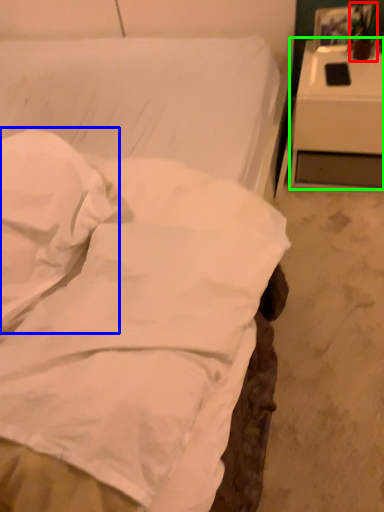
Question: Which object is positioned closest to table lamp (highlighted by a red box)? Select from pillow (highlighted by a blue box) and nightstand (highlighted by a green box).

Choices:
 (A) pillow
 (B) nightstand

Answer: (B)